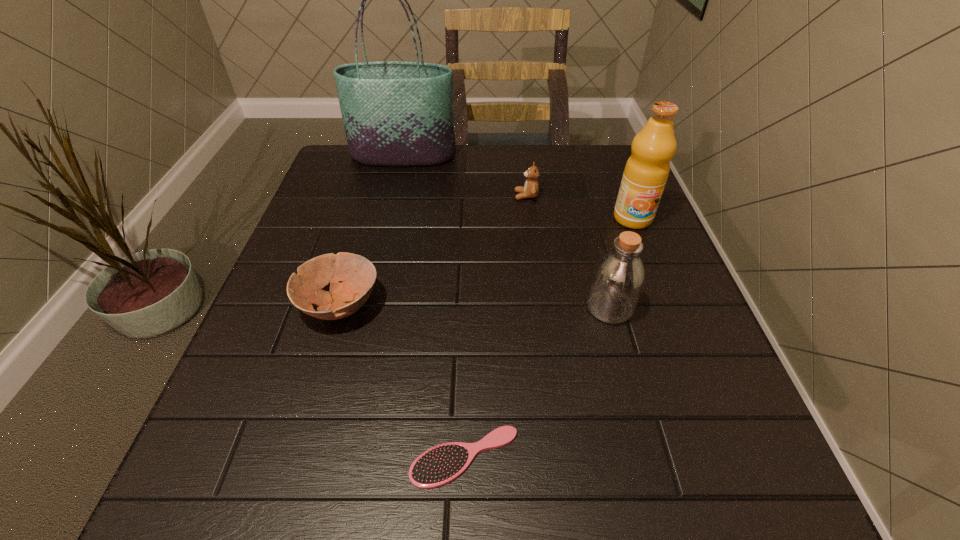
Locate an element on the screen. Image resolution: width=960 pixels, height=540 pixels. vacant area at the right edge of the desktop is located at coordinates (651, 228).

Image resolution: width=960 pixels, height=540 pixels. Find the location of `free region at the near left corner of the desktop`. free region at the near left corner of the desktop is located at coordinates (267, 461).

Image resolution: width=960 pixels, height=540 pixels. What are the coordinates of `free space at the far right corner` in the screenshot? It's located at 576,150.

What are the coordinates of `vacant region between the third farthest object and the shortest object` in the screenshot? It's located at (548, 338).

I want to click on vacant space that is in between the shortest object and the fruit juice, so click(548, 338).

The height and width of the screenshot is (540, 960). In order to click on vacant space that's between the farthest object and the second shortest object in this screenshot , I will do `click(372, 231)`.

The width and height of the screenshot is (960, 540). What are the coordinates of `vacant area that lies between the teddy bear and the fruit juice` in the screenshot? It's located at (580, 207).

Find the location of a particular element. vacant point located between the fruit juice and the third object from right to left is located at coordinates (580, 207).

You are a GUI agent. You are given a task and a screenshot of the screen. Output one action in this format:
    pyautogui.click(x=<x>, y=<y>)
    Task: Click on the free spot between the nearest object and the tallest object
    The width and height of the screenshot is (960, 540).
    Given the screenshot: What is the action you would take?
    pyautogui.click(x=434, y=306)

Locate an element on the screen. This screenshot has height=540, width=960. free spot between the tallest object and the hairbrush is located at coordinates (434, 306).